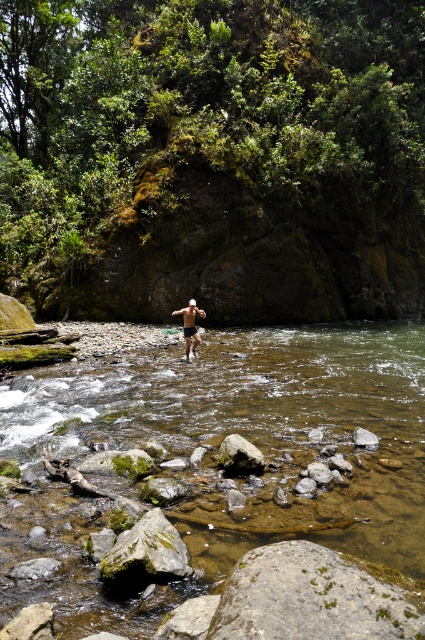
You are a photographer trying to capture the person in the river. Based on the scene, where should you position yourself to ensure both the clear water at stream center and the shiny silver shorts at center are visible in the frame?

To capture both the clear water at stream center and the shiny silver shorts at center, position yourself to the left of the shiny silver shorts at center since the clear water at stream center is on its right side.

You are standing on the riverbank and want to throw a pebble so it lands in the clear water at stream center and then bounces towards the shiny silver shorts at center. Is this possible given their positions?

The clear water at stream center is closer to the viewer than the shiny silver shorts at center, so yes, the pebble can land in the clear water at stream center and bounce towards the shiny silver shorts at center since the shorts are further away.

You are planning to cross the river using the green mossy rock at center as a stepping stone. The clear water at stream center is flowing. Considering the width of the water and the rock, can you safely step from the rock to the opposite bank without getting your feet wet?

The clear water at stream center is wider than the green mossy rock at center. Since the water is wider, the distance between the rock and the opposite bank may be too large to step across safely, increasing the risk of getting wet.